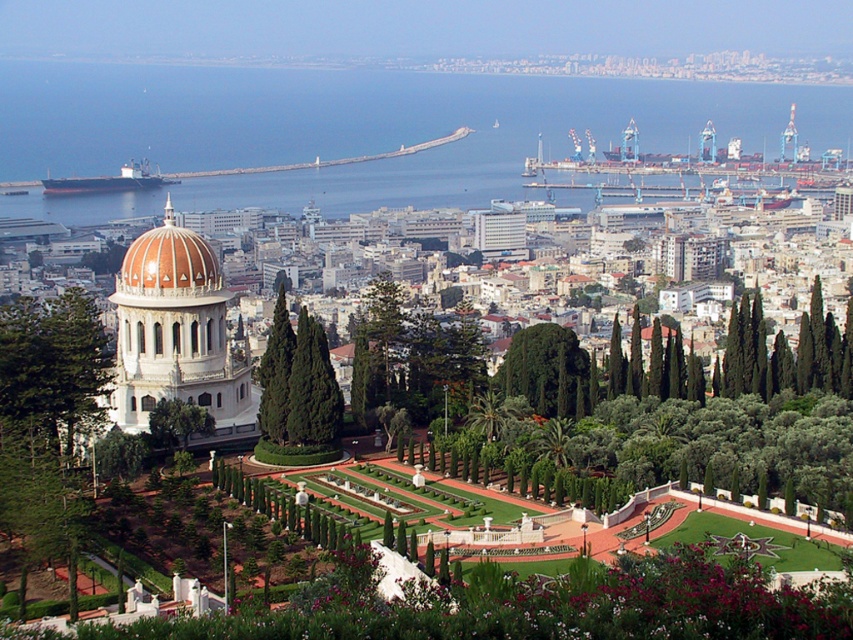
You are standing at the point marked by the coordinates point (51, 368) in the image. Looking towards the Bahai House of Worship with its orange dome, which direction should you walk to reach the building?

The point (51, 368) corresponds to the green leafy tree at center left. To reach the Bahai House of Worship with its orange dome, you should walk towards the right since the tree is positioned to the left of the main building.

You are a landscape architect designing a new garden. You have two trees to place in the center of the garden. The green textured tree at center and the green leafy tree at center. Which tree should you choose if you want to maximize the visual impact of the central area?

The green leafy tree at center should be chosen because it occupies more space than the green textured tree at center, creating a larger and more dominant visual impact in the central area.